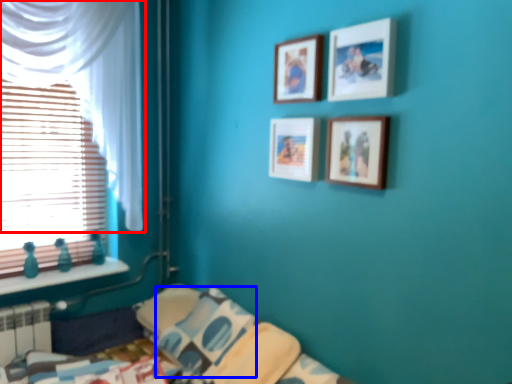
Question: Which point is closer to the camera, curtain (highlighted by a red box) or pillow (highlighted by a blue box)?

Choices:
 (A) curtain
 (B) pillow

Answer: (A)